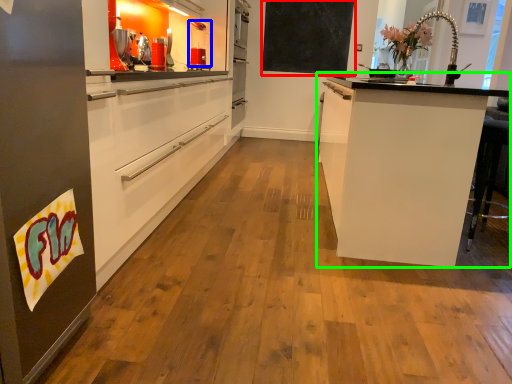
Question: Considering the real-world distances, which object is closest to bulletin board (highlighted by a red box)? kitchen appliance (highlighted by a blue box) or cabinetry (highlighted by a green box).

Choices:
 (A) kitchen appliance
 (B) cabinetry

Answer: (A)